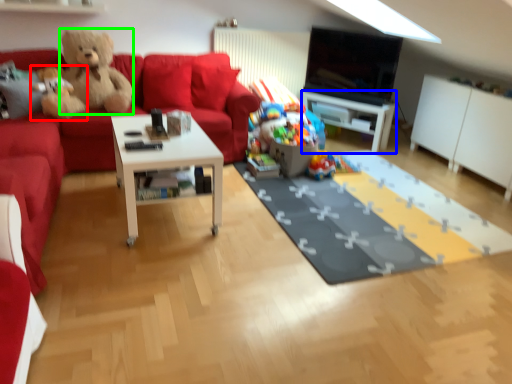
Question: Based on their relative distances, which object is nearer to teddy bear (highlighted by a red box)? Choose from table (highlighted by a blue box) and teddy bear (highlighted by a green box).

Choices:
 (A) table
 (B) teddy bear

Answer: (B)